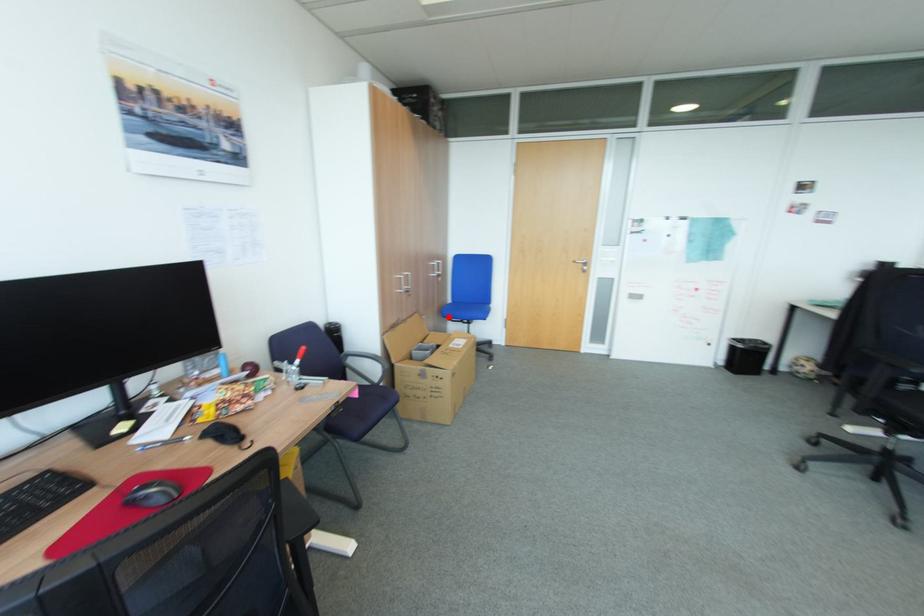
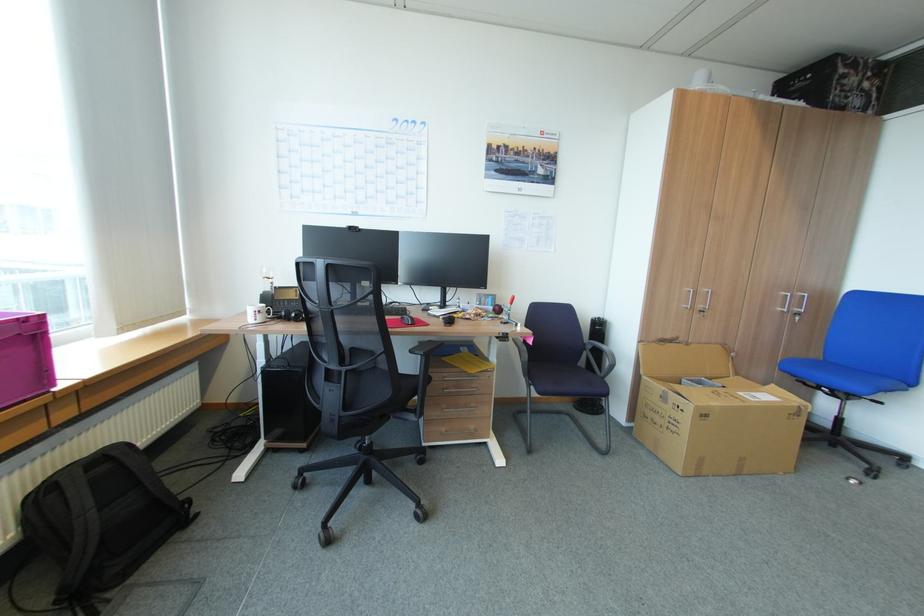
Question: A red point is marked in image1. In image2, is the corresponding 3D point closer to the camera or farther? Reply with the corresponding letter.

Choices:
 (A) The corresponding 3D point is closer.
 (B) The corresponding 3D point is farther.

Answer: (A)